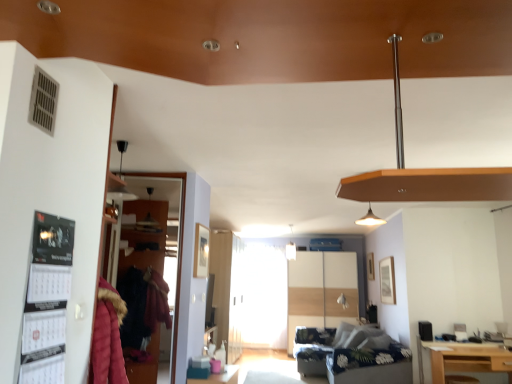
Question: Does point (352, 349) appear closer or farther from the camera than point (506, 367)?

Choices:
 (A) closer
 (B) farther

Answer: (B)

Question: Choose the correct answer: Is dark blue floral fabric couch at lower center inside light brown wooden table at lower right or outside it?

Choices:
 (A) outside
 (B) inside

Answer: (A)

Question: Which object is the farthest from the light brown wooden table at lower right?

Choices:
 (A) transparent glass door at left, which is the 2th glass door from back to front
 (B) dark blue floral fabric couch at lower center
 (C) black paper calendar at left
 (D) matte wood sliding door at center, which is counted as the 2th glass door, starting from the top

Answer: (C)

Question: Based on their relative distances, which object is farther from the black paper calendar at left?

Choices:
 (A) matte wood sliding door at center, which appears as the 1th glass door when ordered from the bottom
 (B) transparent glass door at left, which appears as the 1th glass door when viewed from the left
 (C) light brown wooden table at lower right
 (D) dark blue floral fabric couch at lower center

Answer: (A)